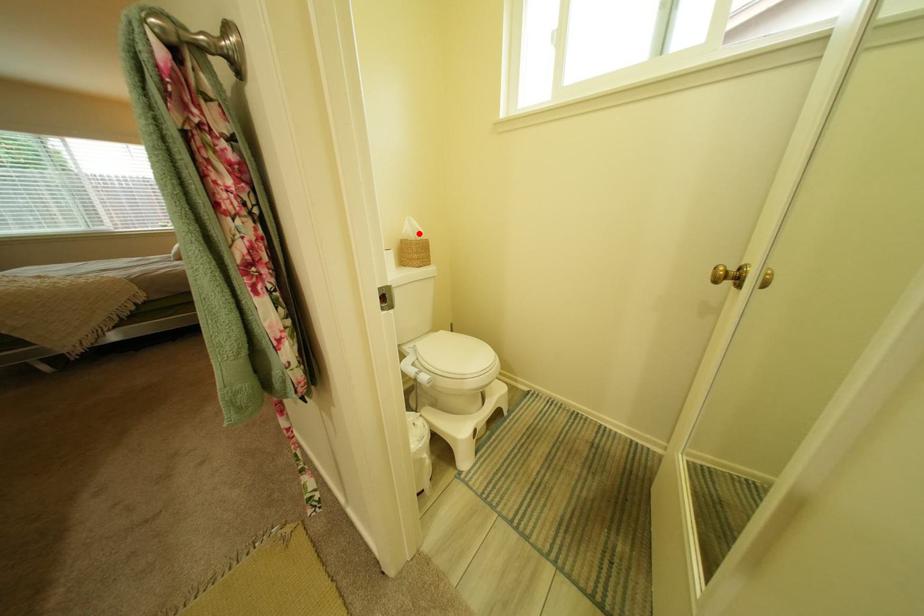
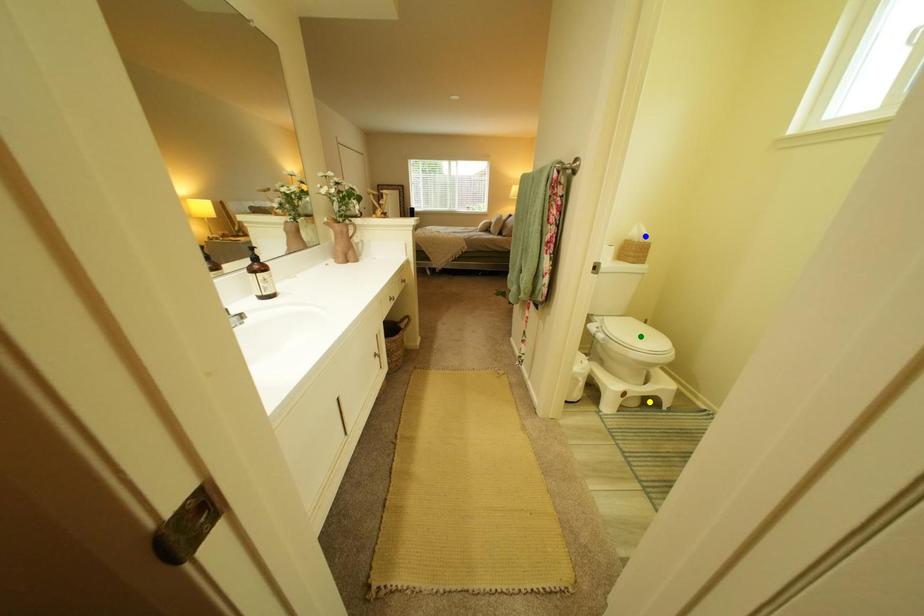
Question: I am providing you with two images of the same scene from different viewpoints. A red point is marked on the first image. You are given multiple points on the second image. Can you choose the point in image 2 that corresponds to the point in image 1?

Choices:
 (A) yellow point
 (B) green point
 (C) blue point

Answer: (C)